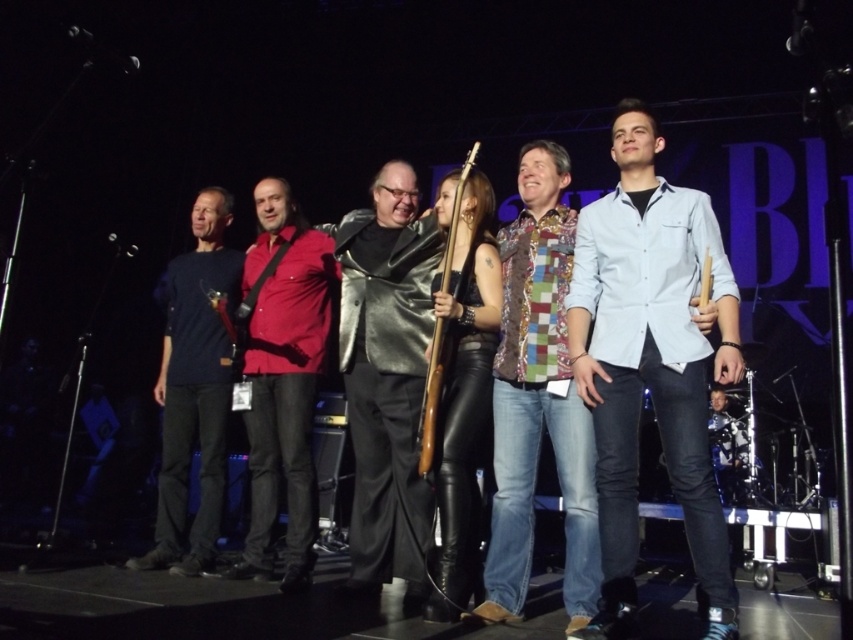
Does point (718, 563) lie behind point (193, 422)?

No, it is not.

Does light blue denim shirt at center come in front of dark blue t-shirt at left?

That is True.

Consider the image. Who is more forward, (576, 353) or (212, 440)?

Point (576, 353)

Identify the location of light blue denim shirt at center. (650, 365).

Measure the distance between light blue denim shirt at center and multicolored patchwork shirt at center.

light blue denim shirt at center and multicolored patchwork shirt at center are 13.43 inches apart from each other.

From the picture: Is light blue denim shirt at center below multicolored patchwork shirt at center?

Incorrect, light blue denim shirt at center is not positioned below multicolored patchwork shirt at center.

Between point (627, 570) and point (514, 406), which one is positioned behind?

The point (514, 406) is behind.

The height and width of the screenshot is (640, 853). Identify the location of light blue denim shirt at center. (650, 365).

Is point (618, 125) farther from viewer compared to point (292, 509)?

No, (618, 125) is in front of (292, 509).

Can you confirm if light blue denim shirt at center is smaller than matte red shirt at center?

Indeed, light blue denim shirt at center has a smaller size compared to matte red shirt at center.

Is point (631, 540) more distant than point (242, 289)?

That is False.

Image resolution: width=853 pixels, height=640 pixels. I want to click on light blue denim shirt at center, so click(x=650, y=365).